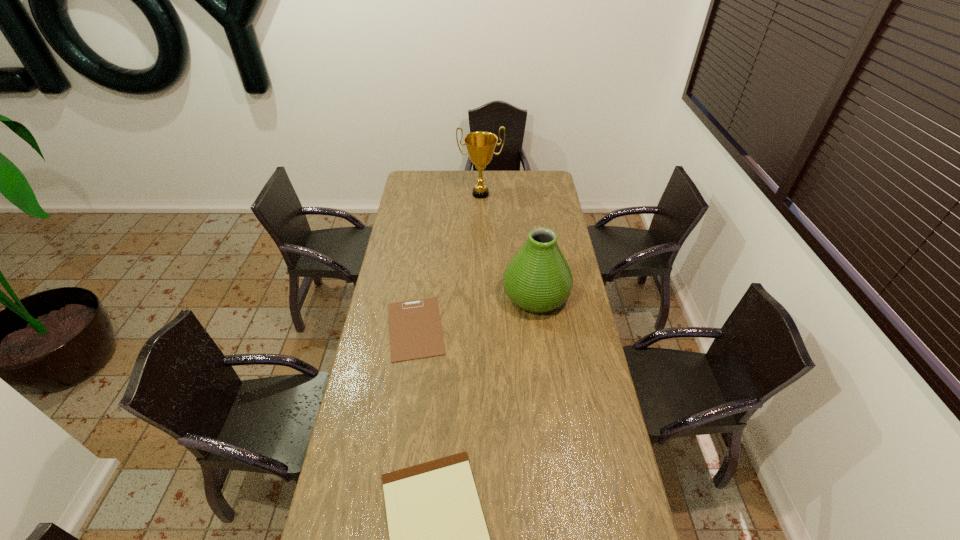
Find the location of a particular element. the tallest object is located at coordinates (480, 145).

You are a GUI agent. You are given a task and a screenshot of the screen. Output one action in this format:
    pyautogui.click(x=<x>, y=<y>)
    Task: Click on the award
    
    Given the screenshot: What is the action you would take?
    pyautogui.click(x=480, y=145)

Where is `vase`? vase is located at coordinates (538, 279).

Where is `the farther clipboard`? The width and height of the screenshot is (960, 540). the farther clipboard is located at coordinates (415, 330).

In order to click on vacant space located on the front view with handles of the farthest object in this screenshot , I will do `click(481, 227)`.

Find the location of a particular element. The width and height of the screenshot is (960, 540). vacant space positioned on the back of the vase is located at coordinates (532, 262).

Image resolution: width=960 pixels, height=540 pixels. In order to click on vacant position located 0.370m on the right of the farther clipboard in this screenshot , I will do `click(536, 328)`.

This screenshot has width=960, height=540. What are the coordinates of `object that is positioned at the far edge` in the screenshot? It's located at [480, 145].

Where is `object situated at the left edge`? The image size is (960, 540). object situated at the left edge is located at coordinates (415, 330).

Identify the location of object situated at the right edge. (538, 279).